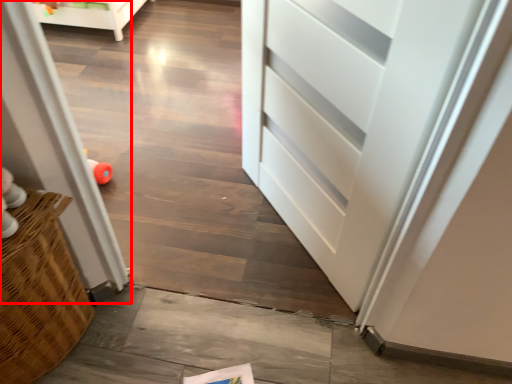
Question: From the image, what is the correct spatial relationship of screen door (annotated by the red box) in relation to toy?

Choices:
 (A) left
 (B) right

Answer: (B)